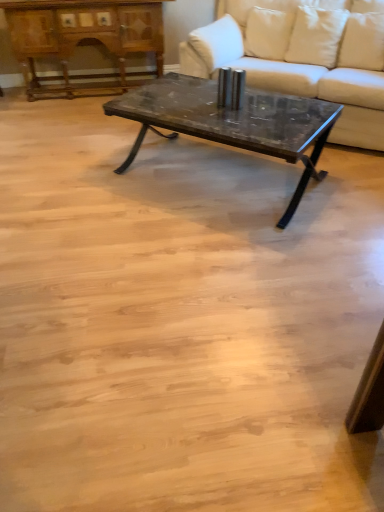
Question: Which is correct: white fabric pillow at upper right, marked as the second pillow in a right-to-left arrangement, is inside dark gray stone coffee table at center, or outside of it?

Choices:
 (A) inside
 (B) outside

Answer: (B)

Question: Is white fabric pillow at upper right, the first pillow when ordered from left to right, in front of or behind dark gray stone coffee table at center in the image?

Choices:
 (A) behind
 (B) front

Answer: (A)

Question: Which object is the farthest from the wooden polished dresser at upper left?

Choices:
 (A) white fabric pillow at upper right, the first pillow when ordered from left to right
 (B) white fabric pillow at upper center, which is the first pillow in right-to-left order
 (C) white fabric couch at center
 (D) dark gray stone coffee table at center

Answer: (D)

Question: Estimate the real-world distances between objects in this image. Which object is farther from the white fabric pillow at upper right, the first pillow when ordered from left to right?

Choices:
 (A) wooden polished dresser at upper left
 (B) dark gray stone coffee table at center
 (C) white fabric couch at center
 (D) white fabric pillow at upper center, which is the first pillow in right-to-left order

Answer: (A)